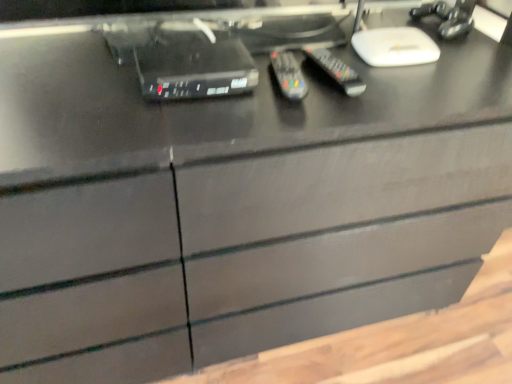
Locate an element on the screen. The image size is (512, 384). vacant space that is in between black plastic remote at center, placed as the 1th control when sorted from left to right, and black plastic remote at center, the second control when ordered from left to right is located at coordinates (322, 90).